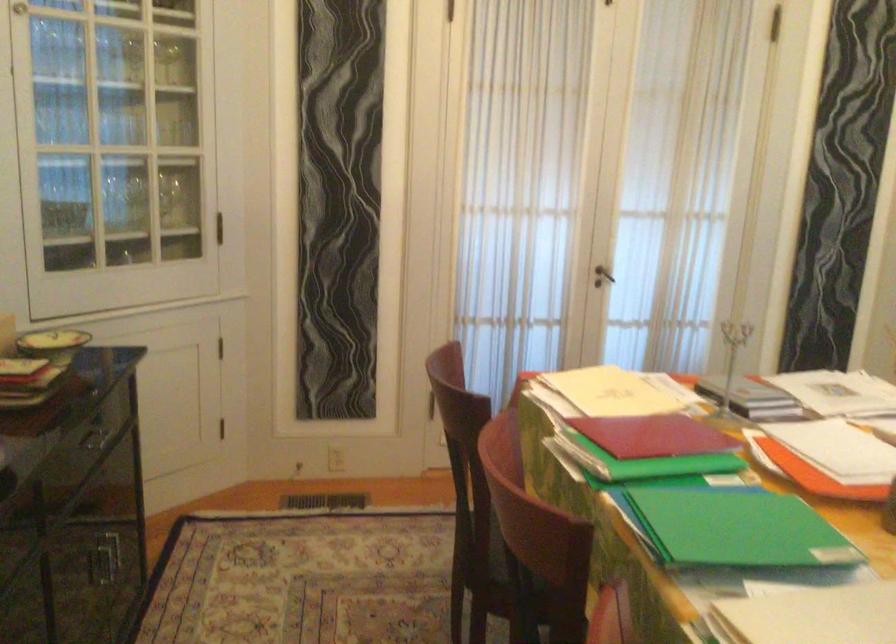
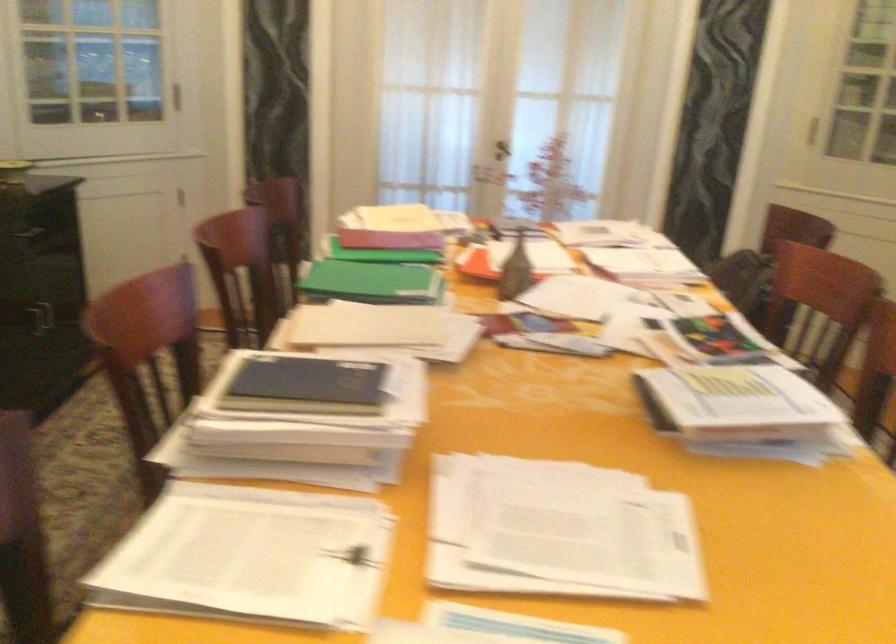
Question: Based on the continuous images, in which direction is the camera rotating? Reply with the corresponding letter.

Choices:
 (A) Left
 (B) Right
 (C) Up
 (D) Down

Answer: (A)